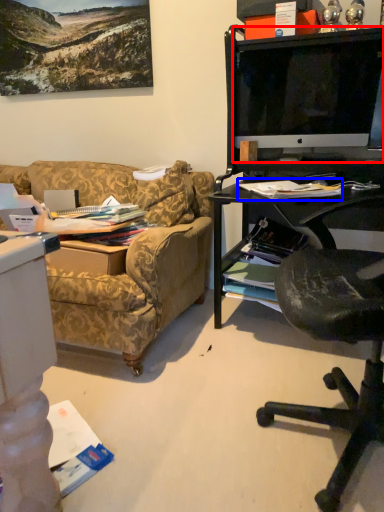
Question: Among these objects, which one is nearest to the camera, television (highlighted by a red box) or magazine (highlighted by a blue box)?

Choices:
 (A) television
 (B) magazine

Answer: (B)